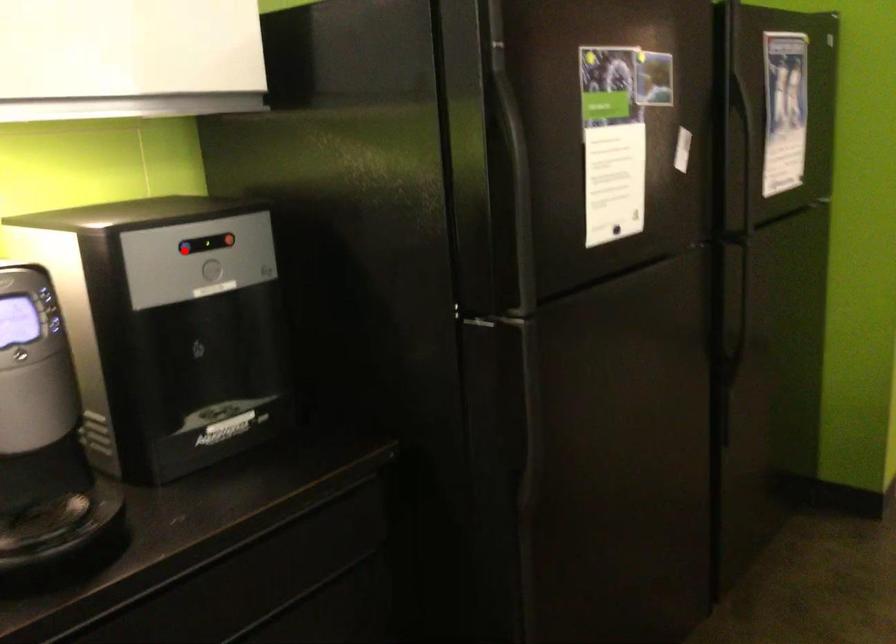
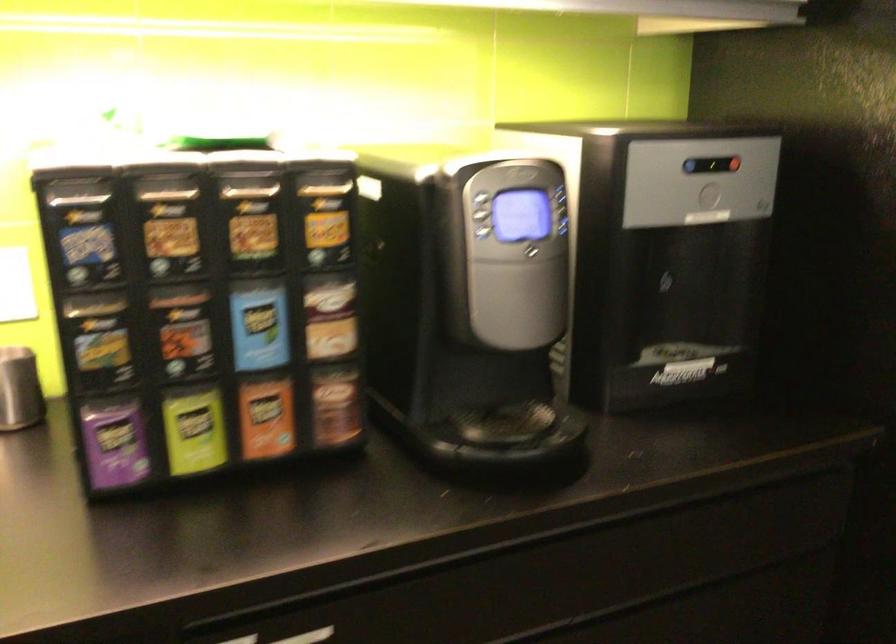
Where in the second image is the point corresponding to the highlighted location from the first image?

(691, 166)